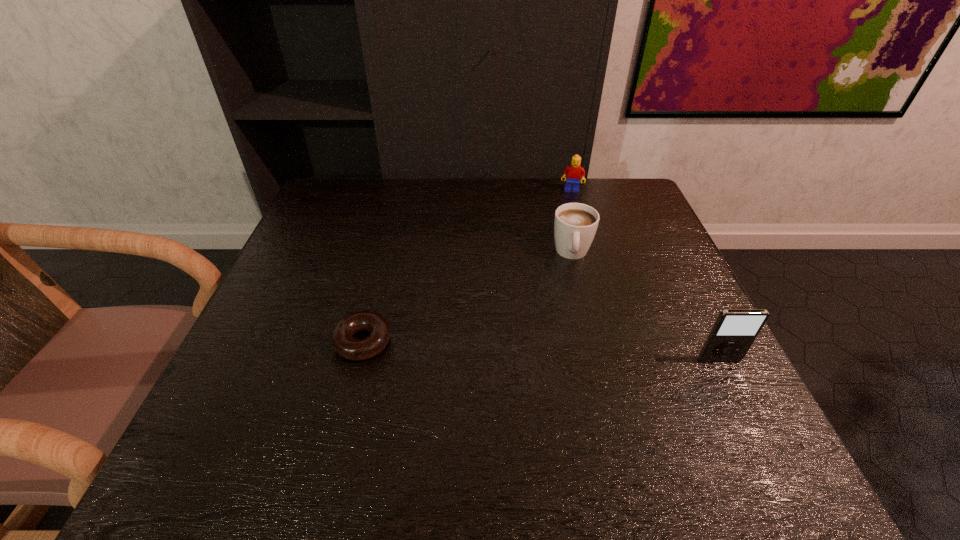
You are a GUI agent. You are given a task and a screenshot of the screen. Output one action in this format:
    pyautogui.click(x=<x>, y=<y>)
    Task: Click on the vacant space that is in between the tallest object and the cappuccino
    This screenshot has height=540, width=960.
    Given the screenshot: What is the action you would take?
    pyautogui.click(x=646, y=307)

Identify the location of unoccupied area between the farthest object and the leftmost object. This screenshot has width=960, height=540. (468, 266).

Locate an element on the screen. This screenshot has height=540, width=960. object identified as the second closest to the tallest object is located at coordinates (347, 346).

Identify which object is the closest to the cappuccino. Please provide its 2D coordinates. Your answer should be formatted as a tuple, i.e. [(x, y)], where the tuple contains the x and y coordinates of a point satisfying the conditions above.

[(574, 172)]

Identify the location of free space that satisfies the following two spatial constraints: 1. on the back side of the cappuccino; 2. on the left side of the doughnut. (385, 253).

Identify the location of vacant position in the image that satisfies the following two spatial constraints: 1. on the back side of the leftmost object; 2. on the left side of the second farthest object. (385, 253).